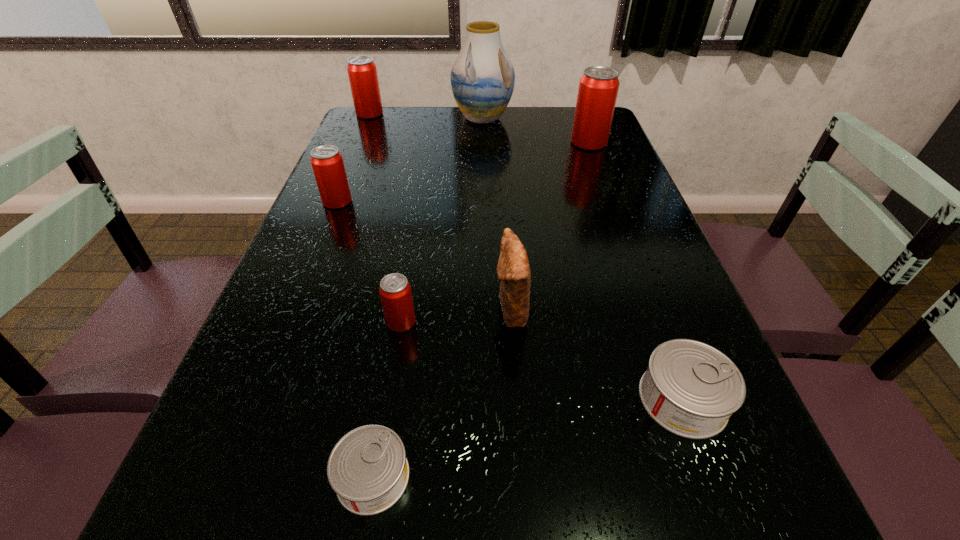
You are a GUI agent. You are given a task and a screenshot of the screen. Output one action in this format:
    pyautogui.click(x=<x>, y=<y>)
    Task: Click on the tallest object
    This screenshot has width=960, height=540.
    Given the screenshot: What is the action you would take?
    pyautogui.click(x=482, y=78)

Where is `the third farthest object`? This screenshot has width=960, height=540. the third farthest object is located at coordinates (598, 87).

Where is `the second farthest can`? the second farthest can is located at coordinates (598, 87).

You are a GUI agent. You are given a task and a screenshot of the screen. Output one action in this format:
    pyautogui.click(x=<x>, y=<y>)
    Task: Click on the farthest red can
    The width and height of the screenshot is (960, 540).
    Given the screenshot: What is the action you would take?
    pyautogui.click(x=362, y=72)

Where is `the farthest can`? the farthest can is located at coordinates (362, 72).

This screenshot has width=960, height=540. In order to click on clutch bag in this screenshot , I will do `click(513, 269)`.

Identify the location of the third farthest can. The image size is (960, 540). (327, 163).

Where is `the third farthest red can`? the third farthest red can is located at coordinates tap(327, 163).

Locate an element on the screen. This screenshot has width=960, height=540. the third nearest can is located at coordinates (395, 292).

Locate an element on the screen. This screenshot has width=960, height=540. the third shortest can is located at coordinates (395, 292).